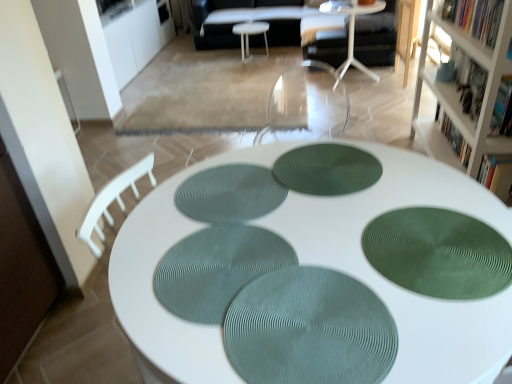
Find the location of `empty space that is in between green textured placemat at center, marked as the 3th mat in a left-to-right arrangement, and green textured mat at lower right, marked as the first mat in a right-to-left arrangement`. empty space that is in between green textured placemat at center, marked as the 3th mat in a left-to-right arrangement, and green textured mat at lower right, marked as the first mat in a right-to-left arrangement is located at coordinates (374, 199).